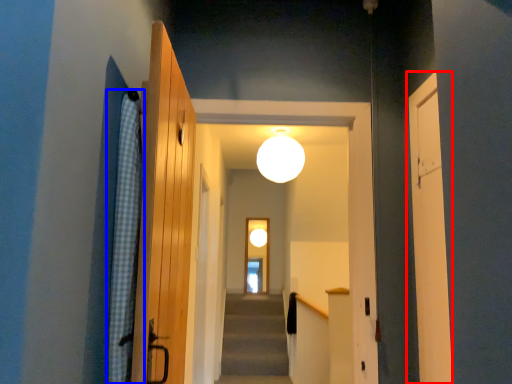
Question: Which of the following is the farthest to the observer, door (highlighted by a red box) or curtain (highlighted by a blue box)?

Choices:
 (A) door
 (B) curtain

Answer: (A)